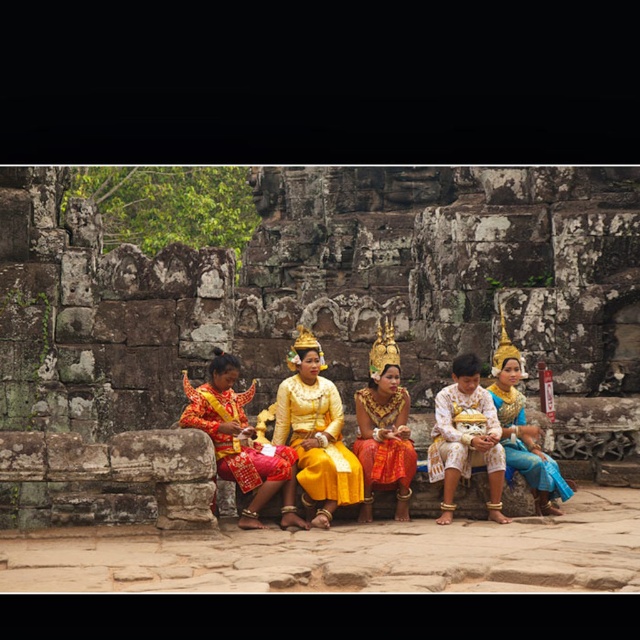
What do you see at coordinates (316, 432) in the screenshot? I see `golden silk dress at center` at bounding box center [316, 432].

Is point (316, 500) closer to camera compared to point (220, 460)?

Yes, point (316, 500) is in front of point (220, 460).

Find the location of `golden silk dress at center`. golden silk dress at center is located at coordinates (316, 432).

In the scene shown: Between golden silk dress at center and white satin costume at center, which one appears on the right side from the viewer's perspective?

From the viewer's perspective, white satin costume at center appears more on the right side.

Between point (289, 403) and point (444, 426), which one is positioned behind?

The point (289, 403) is more distant.

You are a GUI agent. You are given a task and a screenshot of the screen. Output one action in this format:
    pyautogui.click(x=<x>, y=<y>)
    Task: Click on the golden silk dress at center
    
    Given the screenshot: What is the action you would take?
    pyautogui.click(x=316, y=432)

What are the coordinates of `golden silk dress at center` in the screenshot? It's located at (316, 432).

Can you confirm if white satin costume at center is shorter than matte gold headpiece at center?

Incorrect, white satin costume at center's height does not fall short of matte gold headpiece at center's.

The width and height of the screenshot is (640, 640). I want to click on white satin costume at center, so click(x=464, y=433).

Identify the location of white satin costume at center. The height and width of the screenshot is (640, 640). (464, 433).